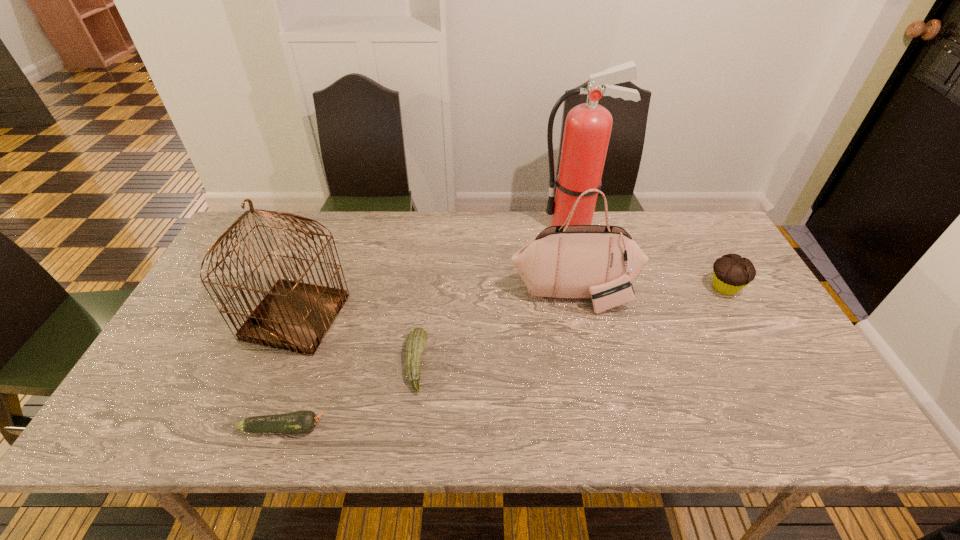
The width and height of the screenshot is (960, 540). In order to click on object that is at the right edge in this screenshot , I will do `click(731, 273)`.

Find the location of a particular element. The image size is (960, 540). vacant space at the far edge of the desktop is located at coordinates (519, 234).

Locate an element on the screen. The width and height of the screenshot is (960, 540). vacant space at the near edge of the desktop is located at coordinates (443, 423).

This screenshot has width=960, height=540. In the image, there is a desktop. In order to click on free space at the right edge in this screenshot , I will do `click(782, 341)`.

You are a GUI agent. You are given a task and a screenshot of the screen. Output one action in this format:
    pyautogui.click(x=<x>, y=<y>)
    Task: Click on the free space at the far left corner of the desktop
    The height and width of the screenshot is (540, 960).
    Given the screenshot: What is the action you would take?
    pyautogui.click(x=253, y=225)

In order to click on free space at the far right corner in this screenshot , I will do `click(672, 232)`.

In the image, there is a desktop. Where is `vacant space at the near right corner`? vacant space at the near right corner is located at coordinates (767, 408).

Locate an element on the screen. The image size is (960, 540). free space between the muffin and the fire extinguisher is located at coordinates (649, 256).

The image size is (960, 540). What are the coordinates of `free space that is in between the left zucchini and the right zucchini` in the screenshot? It's located at (350, 395).

Where is `vacant point located between the third object from left to right and the fourth tallest object`? This screenshot has height=540, width=960. vacant point located between the third object from left to right and the fourth tallest object is located at coordinates (570, 326).